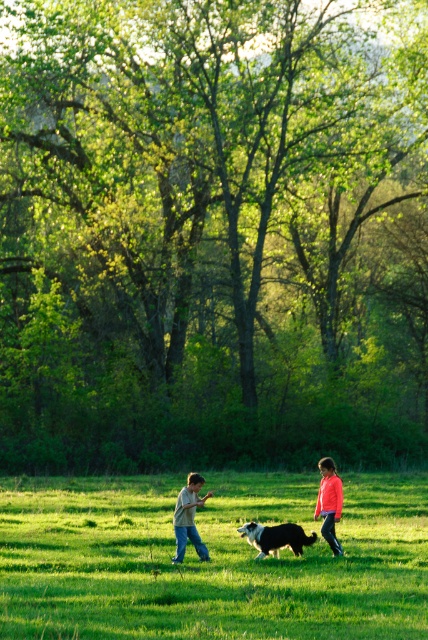
Question: Which is nearer to the light brown cotton shirt at center?

Choices:
 (A) soft brown fur at center
 (B) matte pink shirt at center
 (C) green grassy field at center

Answer: (A)

Question: Estimate the real-world distances between objects in this image. Which object is closer to the light brown cotton shirt at center?

Choices:
 (A) matte pink shirt at center
 (B) green grassy field at center
 (C) soft brown fur at center

Answer: (C)

Question: Which point is closer to the camera?

Choices:
 (A) light brown cotton shirt at center
 (B) matte pink shirt at center
 (C) green grassy field at center

Answer: (C)

Question: Is green grassy field at center wider than matte pink shirt at center?

Choices:
 (A) no
 (B) yes

Answer: (B)

Question: Does light brown cotton shirt at center have a lesser width compared to matte pink shirt at center?

Choices:
 (A) yes
 (B) no

Answer: (B)

Question: Observing the image, what is the correct spatial positioning of green grassy field at center in reference to soft brown fur at center?

Choices:
 (A) left
 (B) right

Answer: (A)